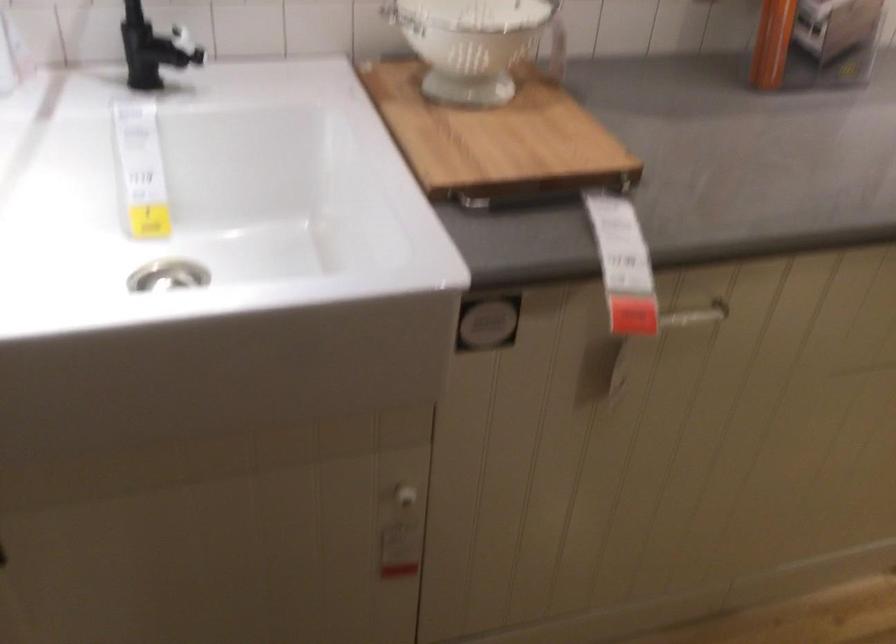
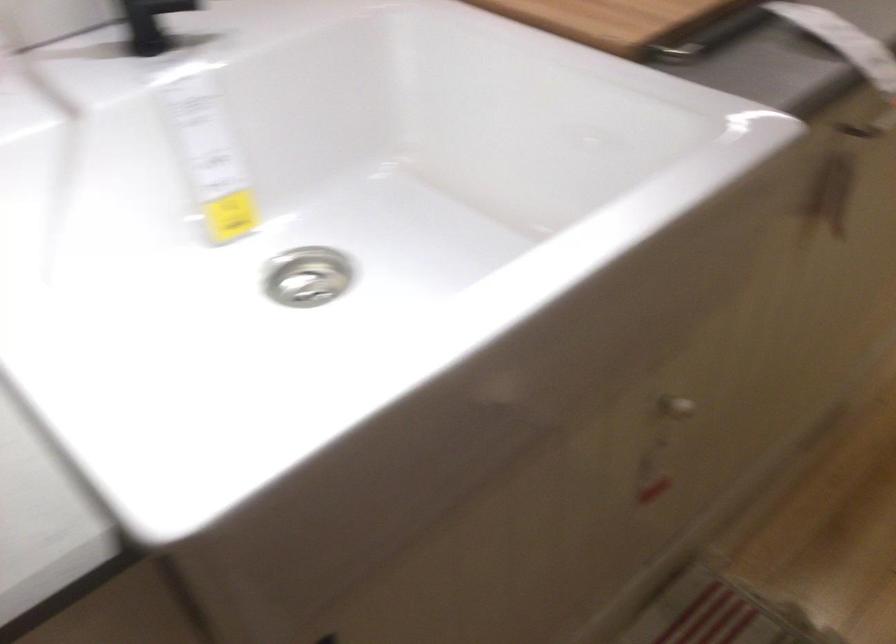
Question: The camera is either moving clockwise (left) or counter-clockwise (right) around the object. The first image is from the beginning of the video and the second image is from the end. Is the camera moving left or right when shooting the video?

Choices:
 (A) Left
 (B) Right

Answer: (A)